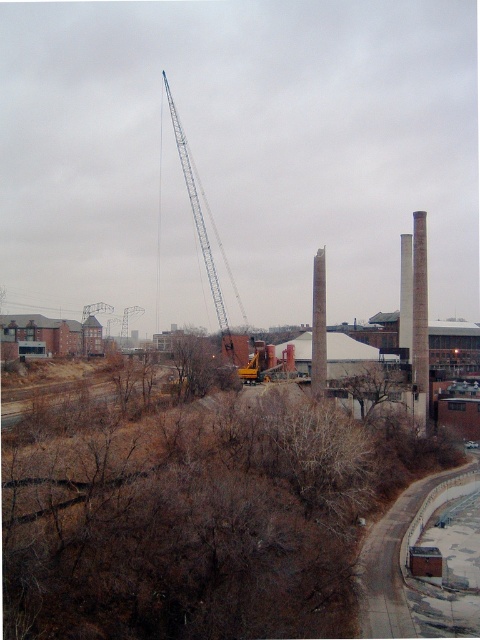
Is brown leafless shrub at lower left shorter than brown rough tree at center?

In fact, brown leafless shrub at lower left may be taller than brown rough tree at center.

Which is in front, point (239, 484) or point (173, 340)?

Point (239, 484) is more forward.

This screenshot has width=480, height=640. I want to click on brown leafless shrub at lower left, so click(x=193, y=515).

Between brown leafless shrub at lower left and gray concrete chimney at center, which one is positioned lower?

brown leafless shrub at lower left

Is brown leafless shrub at lower left taller than gray concrete chimney at center?

No, brown leafless shrub at lower left is not taller than gray concrete chimney at center.

The width and height of the screenshot is (480, 640). Describe the element at coordinates (193, 515) in the screenshot. I see `brown leafless shrub at lower left` at that location.

Where is `brown leafless shrub at lower left`? This screenshot has height=640, width=480. brown leafless shrub at lower left is located at coordinates (193, 515).

Does brown leafless tree at center appear under gray concrete chimney at center?

Yes.

Between brown leafless tree at center and gray concrete chimney at center, which one appears on the right side from the viewer's perspective?

brown leafless tree at center is more to the right.

Between point (371, 380) and point (320, 298), which one is positioned in front?

Point (371, 380) is in front.

The width and height of the screenshot is (480, 640). I want to click on brown leafless tree at center, so click(373, 387).